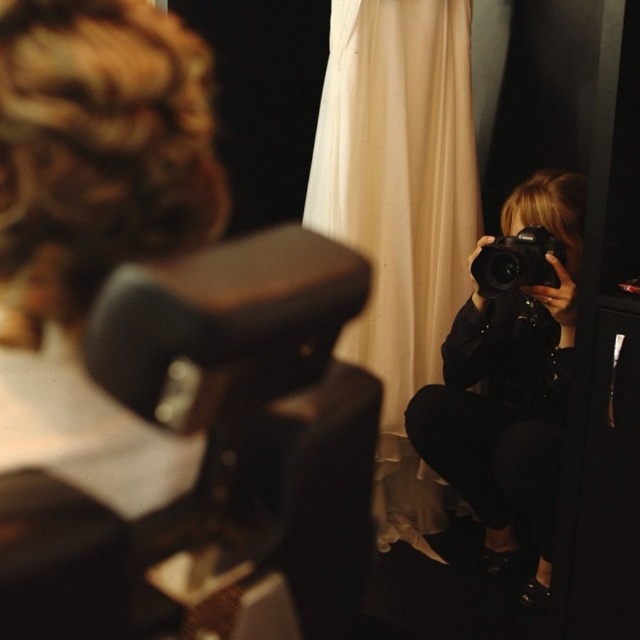
Question: Which point is closer to the camera?

Choices:
 (A) black plastic camera at right
 (B) white fabric curtain at center

Answer: (A)

Question: Is white fabric curtain at center to the left of black plastic camera at right from the viewer's perspective?

Choices:
 (A) yes
 (B) no

Answer: (A)

Question: Which point is closer to the camera?

Choices:
 (A) white fabric curtain at center
 (B) black matte camera at center
 (C) black plastic camera at right

Answer: (C)

Question: Does white fabric curtain at center appear under black matte camera at center?

Choices:
 (A) no
 (B) yes

Answer: (A)

Question: Does white fabric curtain at center appear on the left side of black plastic camera at right?

Choices:
 (A) no
 (B) yes

Answer: (B)

Question: Which point is closer to the camera?

Choices:
 (A) black plastic camera at right
 (B) black matte camera at center

Answer: (A)